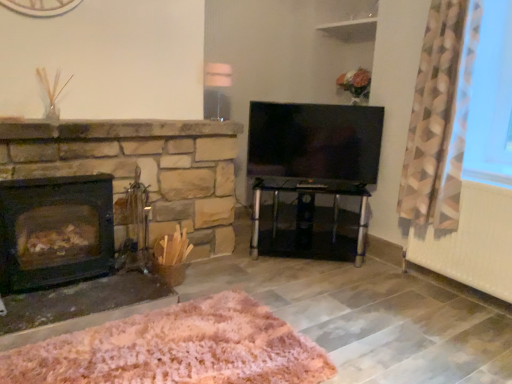
Question: Can you confirm if flat-screen tv at center is thinner than white painted radiator at lower right?

Choices:
 (A) no
 (B) yes

Answer: (B)

Question: Is flat-screen tv at center taller than white painted radiator at lower right?

Choices:
 (A) yes
 (B) no

Answer: (B)

Question: Does flat-screen tv at center have a greater width compared to white painted radiator at lower right?

Choices:
 (A) no
 (B) yes

Answer: (A)

Question: Is flat-screen tv at center positioned with its back to white painted radiator at lower right?

Choices:
 (A) yes
 (B) no

Answer: (B)

Question: Can you confirm if flat-screen tv at center is shorter than white painted radiator at lower right?

Choices:
 (A) no
 (B) yes

Answer: (B)

Question: Visually, is geometric-patterned fabric at right positioned to the left or to the right of flat-screen tv at center?

Choices:
 (A) left
 (B) right

Answer: (B)

Question: Is point pos(418,115) positioned closer to the camera than point pos(251,165)?

Choices:
 (A) farther
 (B) closer

Answer: (B)

Question: Is geometric-patterned fabric at right taller or shorter than flat-screen tv at center?

Choices:
 (A) short
 (B) tall

Answer: (B)

Question: Is geometric-patterned fabric at right in front of or behind flat-screen tv at center in the image?

Choices:
 (A) behind
 (B) front

Answer: (B)

Question: From a real-world perspective, is geometric-patterned fabric at right physically located above or below transparent glass table at center?

Choices:
 (A) above
 (B) below

Answer: (A)

Question: Considering the positions of geometric-patterned fabric at right and transparent glass table at center in the image, is geometric-patterned fabric at right wider or thinner than transparent glass table at center?

Choices:
 (A) thin
 (B) wide

Answer: (B)

Question: From the image's perspective, relative to transparent glass table at center, is geometric-patterned fabric at right above or below?

Choices:
 (A) above
 (B) below

Answer: (A)

Question: Based on their sizes in the image, would you say geometric-patterned fabric at right is bigger or smaller than transparent glass table at center?

Choices:
 (A) small
 (B) big

Answer: (B)

Question: Is geometric-patterned fabric at right taller or shorter than pink fluffy rug at lower center?

Choices:
 (A) tall
 (B) short

Answer: (A)

Question: Is point (439, 135) positioned closer to the camera than point (212, 337)?

Choices:
 (A) closer
 (B) farther

Answer: (B)